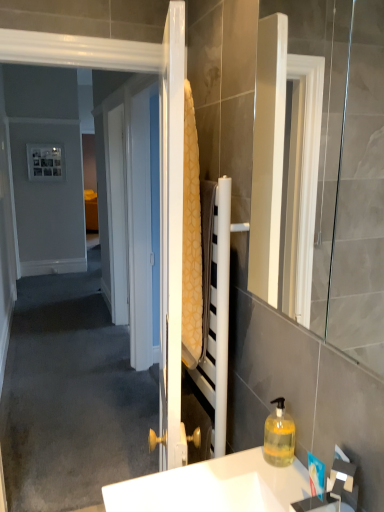
Question: Is translucent yellow liquid at lower right in contact with white glossy mirror at right?

Choices:
 (A) no
 (B) yes

Answer: (A)

Question: Is translucent yellow liquid at lower right outside white glossy mirror at right?

Choices:
 (A) no
 (B) yes

Answer: (B)

Question: Considering the relative sizes of translucent yellow liquid at lower right and white glossy mirror at right in the image provided, is translucent yellow liquid at lower right shorter than white glossy mirror at right?

Choices:
 (A) no
 (B) yes

Answer: (B)

Question: Considering the relative positions of translucent yellow liquid at lower right and white glossy mirror at right in the image provided, is translucent yellow liquid at lower right in front of white glossy mirror at right?

Choices:
 (A) no
 (B) yes

Answer: (A)

Question: Is translucent yellow liquid at lower right bigger than white glossy mirror at right?

Choices:
 (A) yes
 (B) no

Answer: (B)

Question: Considering the positions of yellow textured towel at center and white glossy mirror at right in the image, is yellow textured towel at center wider or thinner than white glossy mirror at right?

Choices:
 (A) thin
 (B) wide

Answer: (A)

Question: Is yellow textured towel at center inside or outside of white glossy mirror at right?

Choices:
 (A) outside
 (B) inside

Answer: (A)

Question: From the image's perspective, is yellow textured towel at center above or below white glossy mirror at right?

Choices:
 (A) above
 (B) below

Answer: (B)

Question: From a real-world perspective, is yellow textured towel at center physically located above or below white glossy mirror at right?

Choices:
 (A) above
 (B) below

Answer: (B)

Question: Does point (241, 506) appear closer or farther from the camera than point (289, 441)?

Choices:
 (A) closer
 (B) farther

Answer: (A)

Question: Looking at the image, does white glossy sink at lower center seem bigger or smaller compared to translucent yellow liquid at lower right?

Choices:
 (A) big
 (B) small

Answer: (A)

Question: Is white glossy sink at lower center situated inside translucent yellow liquid at lower right or outside?

Choices:
 (A) outside
 (B) inside

Answer: (A)

Question: Considering the positions of white glossy sink at lower center and translucent yellow liquid at lower right in the image, is white glossy sink at lower center wider or thinner than translucent yellow liquid at lower right?

Choices:
 (A) thin
 (B) wide

Answer: (B)

Question: In the image, is yellow textured towel at center positioned in front of or behind white glossy sink at lower center?

Choices:
 (A) behind
 (B) front

Answer: (A)

Question: Considering the positions of yellow textured towel at center and white glossy sink at lower center in the image, is yellow textured towel at center wider or thinner than white glossy sink at lower center?

Choices:
 (A) wide
 (B) thin

Answer: (B)